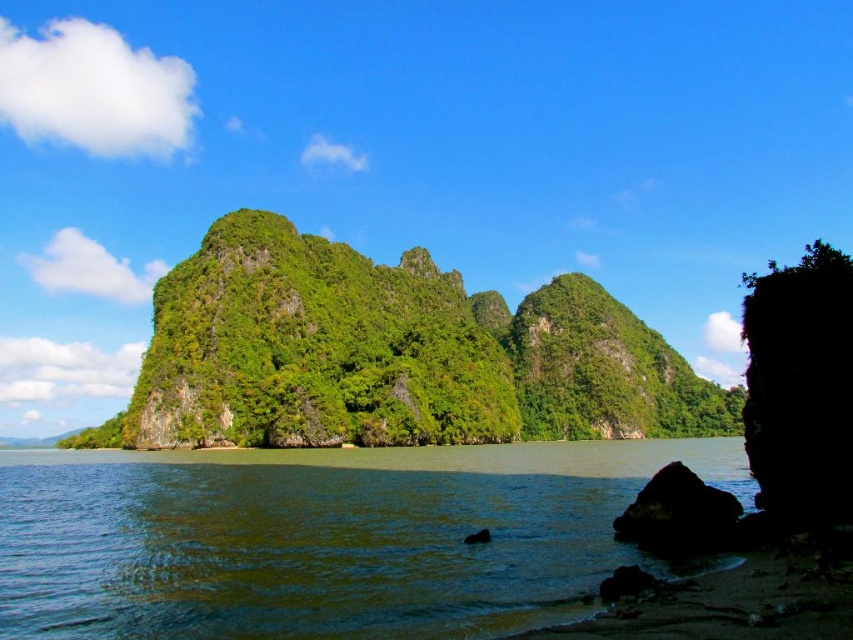
Which is above, green water at lower left or green rocky island at center?

green rocky island at center is above.

Can you confirm if green water at lower left is taller than green rocky island at center?

Incorrect, green water at lower left's height is not larger of green rocky island at center's.

At what (x,y) coordinates should I click in order to perform the action: click on green water at lower left. Please return your answer as a coordinate pair (x, y). Looking at the image, I should click on (323, 538).

Find the location of a particular element. The height and width of the screenshot is (640, 853). green water at lower left is located at coordinates (323, 538).

Does green rocky island at center have a lesser height compared to black rock at lower right?

No.

Can you confirm if green rocky island at center is positioned above black rock at lower right?

Correct, green rocky island at center is located above black rock at lower right.

Is point (680, 420) positioned after point (677, 515)?

Yes, it is behind point (677, 515).

Locate an element on the screen. green rocky island at center is located at coordinates (392, 355).

Is point (587, 532) closer to camera compared to point (694, 538)?

No, it is not.

Who is positioned more to the left, green water at lower left or black rock at lower right?

From the viewer's perspective, green water at lower left appears more on the left side.

Is point (248, 577) less distant than point (670, 532)?

Yes, it is.

Locate an element on the screen. Image resolution: width=853 pixels, height=640 pixels. green water at lower left is located at coordinates (323, 538).